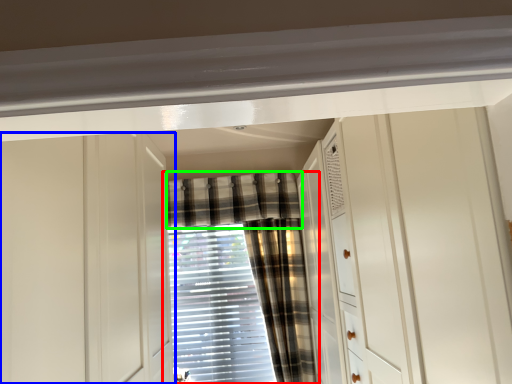
Question: Based on their relative distances, which object is nearer to curtain (highlighted by a red box)? Choose from cabinetry (highlighted by a blue box) and curtain (highlighted by a green box).

Choices:
 (A) cabinetry
 (B) curtain

Answer: (B)